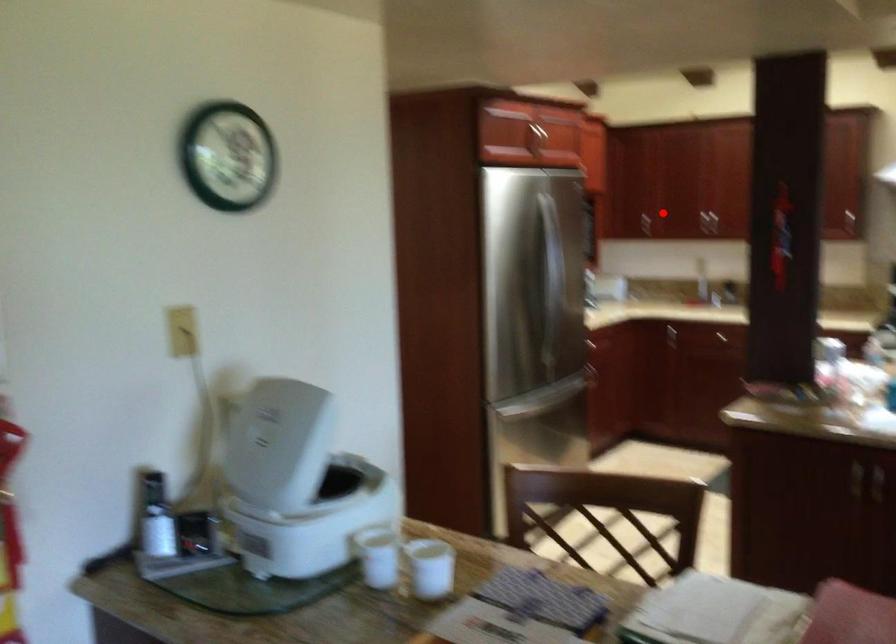
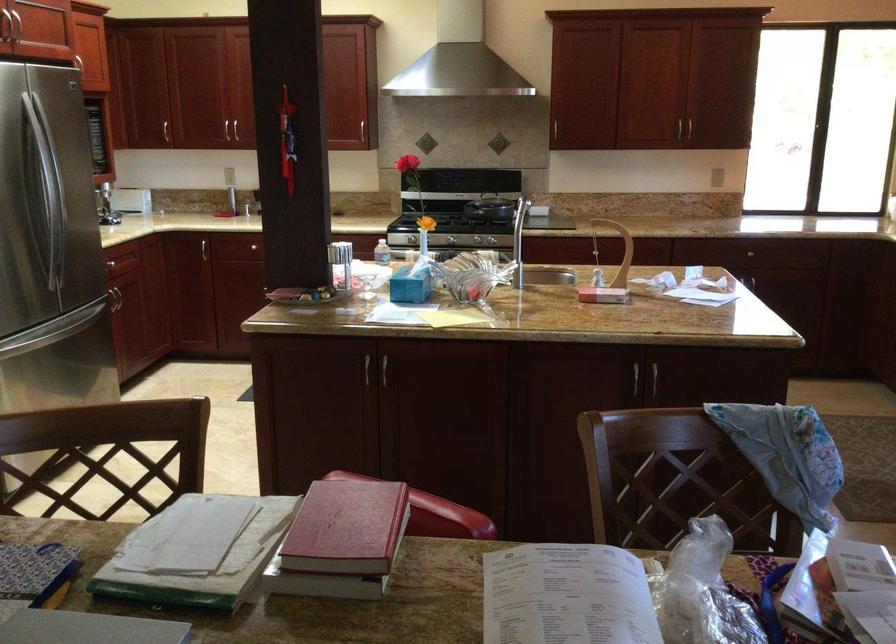
In the second image, find the point that corresponds to the highlighted location in the first image.

(165, 131)